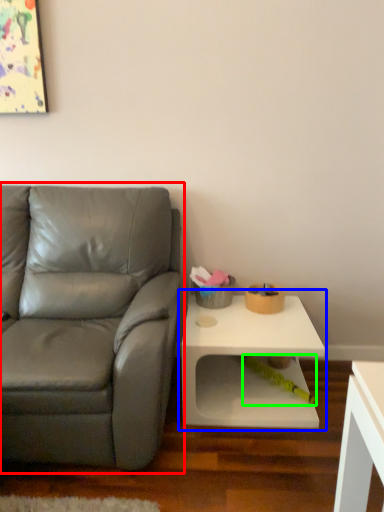
Question: Which object is the closest to the studio couch (highlighted by a red box)? Choose among these: table (highlighted by a blue box) or toy (highlighted by a green box).

Choices:
 (A) table
 (B) toy

Answer: (A)